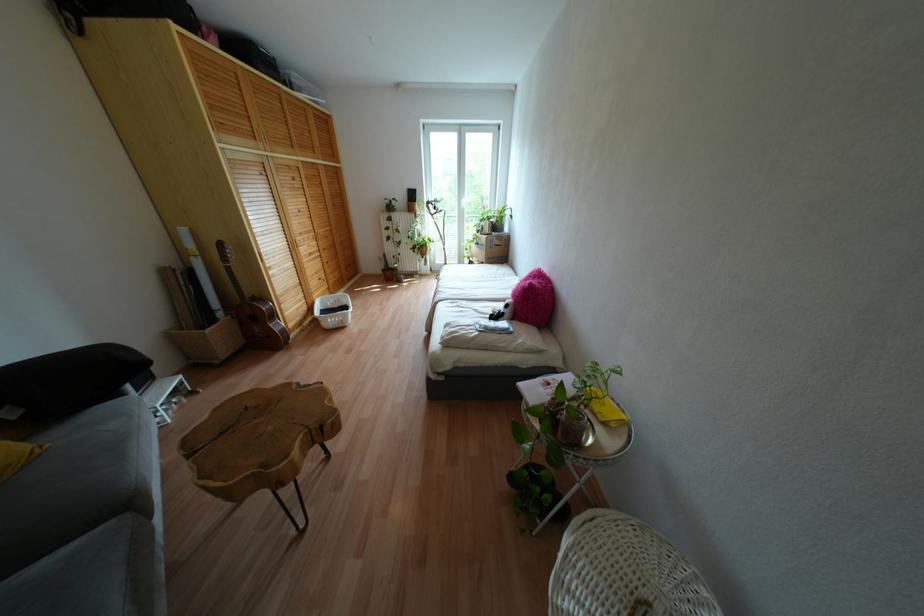
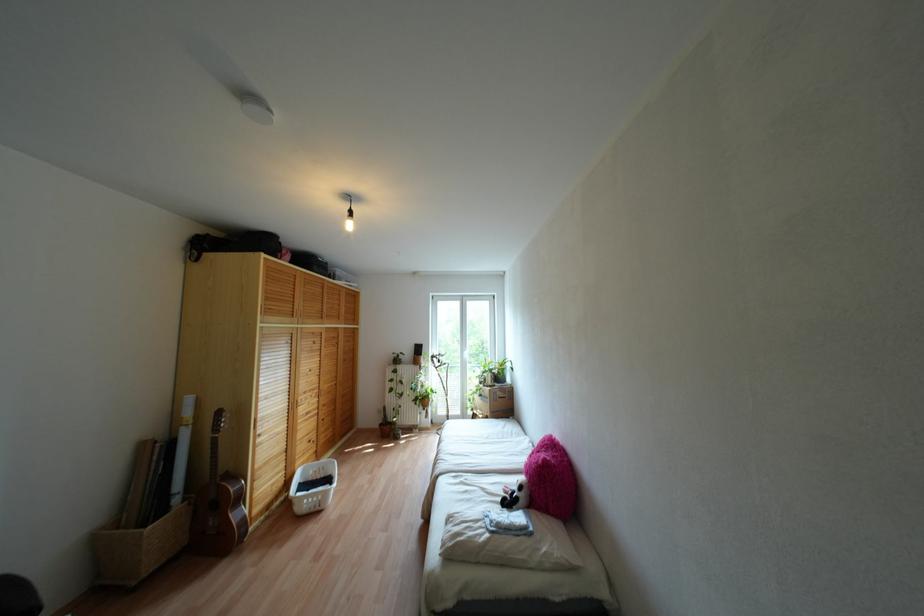
In the second image, find the point that corresponds to [339,325] in the first image.

(317, 508)